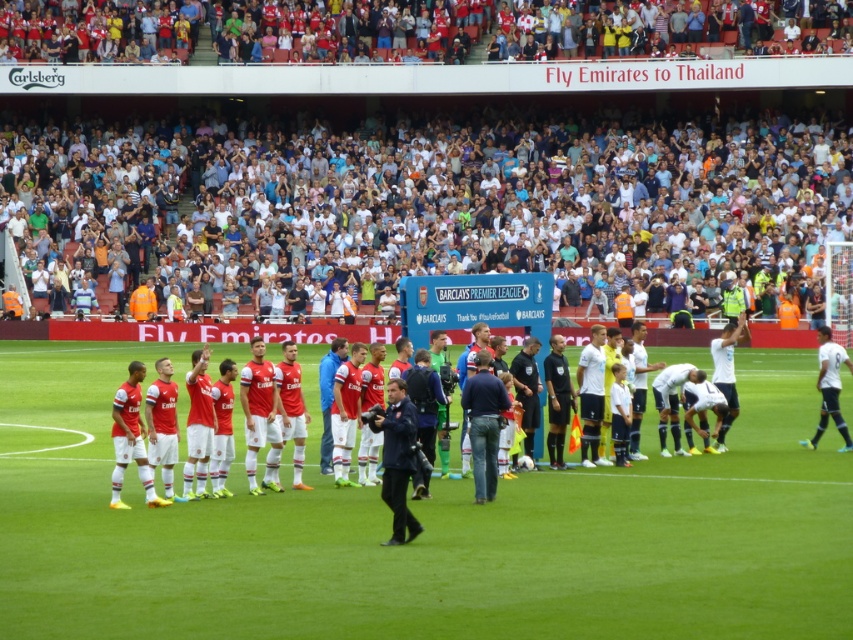
Question: Can you confirm if white synthetic turf at center is positioned above red matte soccer team at center?

Choices:
 (A) no
 (B) yes

Answer: (A)

Question: Among these objects, which one is farthest from the camera?

Choices:
 (A) white synthetic turf at center
 (B) white cotton crowd at upper center

Answer: (B)

Question: Observing the image, what is the correct spatial positioning of white synthetic turf at center in reference to white cotton crowd at upper center?

Choices:
 (A) left
 (B) right

Answer: (B)

Question: Which object is the farthest from the white smooth soccer player at right?

Choices:
 (A) white synthetic turf at center
 (B) white cotton crowd at upper center
 (C) red matte soccer team at center

Answer: (B)

Question: Can you confirm if white cotton crowd at upper center is positioned below red matte soccer team at center?

Choices:
 (A) yes
 (B) no

Answer: (B)

Question: Which is farther from the white smooth soccer player at right?

Choices:
 (A) white synthetic turf at center
 (B) white cotton crowd at upper center

Answer: (B)